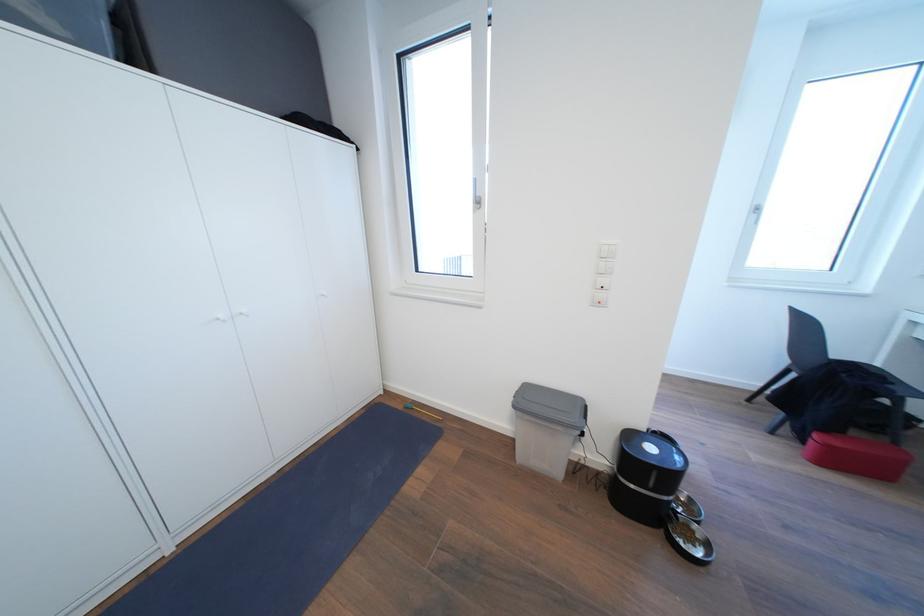
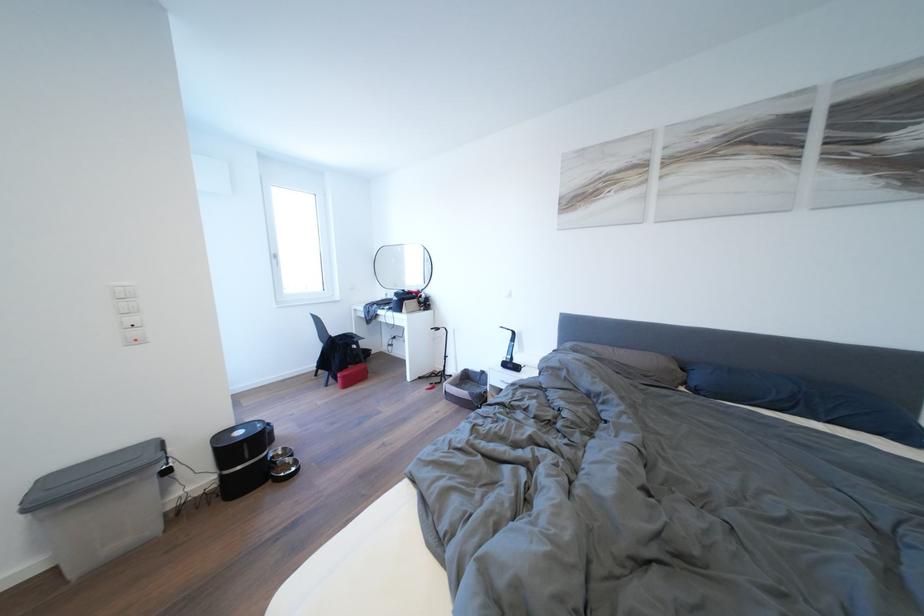
In the second image, find the point that corresponds to (659,453) in the first image.

(248, 438)